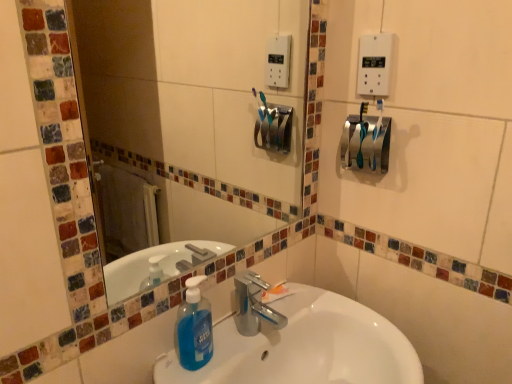
Question: Is white plastic light switch at upper right oriented away from glass mosaic mirror at upper center?

Choices:
 (A) yes
 (B) no

Answer: (B)

Question: Considering the relative positions of white plastic light switch at upper right and glass mosaic mirror at upper center in the image provided, is white plastic light switch at upper right in front of glass mosaic mirror at upper center?

Choices:
 (A) yes
 (B) no

Answer: (B)

Question: Is white plastic light switch at upper right touching glass mosaic mirror at upper center?

Choices:
 (A) yes
 (B) no

Answer: (B)

Question: Can you confirm if white plastic light switch at upper right is bigger than glass mosaic mirror at upper center?

Choices:
 (A) yes
 (B) no

Answer: (B)

Question: Can we say white plastic light switch at upper right lies outside glass mosaic mirror at upper center?

Choices:
 (A) yes
 (B) no

Answer: (A)

Question: From their relative heights in the image, would you say satin silver towel bar at upper right is taller or shorter than white plastic light switch at upper right?

Choices:
 (A) tall
 (B) short

Answer: (B)

Question: Considering the positions of satin silver towel bar at upper right and white plastic light switch at upper right in the image, is satin silver towel bar at upper right bigger or smaller than white plastic light switch at upper right?

Choices:
 (A) big
 (B) small

Answer: (A)

Question: In terms of width, does satin silver towel bar at upper right look wider or thinner when compared to white plastic light switch at upper right?

Choices:
 (A) wide
 (B) thin

Answer: (A)

Question: From a real-world perspective, is satin silver towel bar at upper right positioned above or below white plastic light switch at upper right?

Choices:
 (A) below
 (B) above

Answer: (A)

Question: Looking at the image, does satin silver towel bar at upper right seem bigger or smaller compared to blue translucent liquid soap at center?

Choices:
 (A) big
 (B) small

Answer: (A)

Question: Would you say satin silver towel bar at upper right is inside or outside blue translucent liquid soap at center?

Choices:
 (A) inside
 (B) outside

Answer: (B)

Question: In the image, is satin silver towel bar at upper right positioned in front of or behind blue translucent liquid soap at center?

Choices:
 (A) behind
 (B) front

Answer: (A)

Question: From the image's perspective, is satin silver towel bar at upper right above or below blue translucent liquid soap at center?

Choices:
 (A) below
 (B) above

Answer: (B)

Question: Considering their positions, is blue translucent liquid soap at center located in front of or behind glass mosaic mirror at upper center?

Choices:
 (A) behind
 (B) front

Answer: (A)

Question: Is blue translucent liquid soap at center wider or thinner than glass mosaic mirror at upper center?

Choices:
 (A) thin
 (B) wide

Answer: (B)